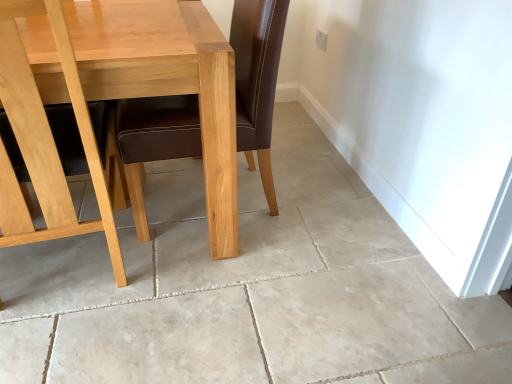
Question: Can you see beige tile floor at center touching light brown wood table at center?

Choices:
 (A) no
 (B) yes

Answer: (A)

Question: Is beige tile floor at center outside of light brown wood table at center?

Choices:
 (A) yes
 (B) no

Answer: (A)

Question: From the image's perspective, is beige tile floor at center above light brown wood table at center?

Choices:
 (A) yes
 (B) no

Answer: (B)

Question: Considering the relative sizes of beige tile floor at center and light brown wood table at center in the image provided, is beige tile floor at center taller than light brown wood table at center?

Choices:
 (A) no
 (B) yes

Answer: (A)

Question: Considering the relative sizes of beige tile floor at center and light brown wood table at center in the image provided, is beige tile floor at center shorter than light brown wood table at center?

Choices:
 (A) no
 (B) yes

Answer: (B)

Question: Does beige tile floor at center lie in front of light brown wood table at center?

Choices:
 (A) no
 (B) yes

Answer: (B)

Question: Is light brown wood chair at left beside beige tile floor at center?

Choices:
 (A) no
 (B) yes

Answer: (A)

Question: Can you confirm if light brown wood chair at left is bigger than beige tile floor at center?

Choices:
 (A) yes
 (B) no

Answer: (A)

Question: Is light brown wood chair at left not within beige tile floor at center?

Choices:
 (A) yes
 (B) no

Answer: (A)

Question: Considering the relative sizes of light brown wood chair at left and beige tile floor at center in the image provided, is light brown wood chair at left thinner than beige tile floor at center?

Choices:
 (A) no
 (B) yes

Answer: (B)

Question: Is light brown wood chair at left far from beige tile floor at center?

Choices:
 (A) yes
 (B) no

Answer: (B)

Question: Does light brown wood chair at left appear on the right side of beige tile floor at center?

Choices:
 (A) yes
 (B) no

Answer: (B)

Question: Can you confirm if light brown wood chair at left is bigger than light brown wood table at center?

Choices:
 (A) no
 (B) yes

Answer: (A)